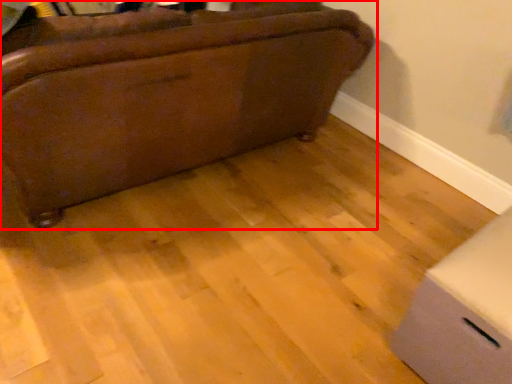
Question: Where is furniture (annotated by the red box) located in relation to cardboard box in the image?

Choices:
 (A) left
 (B) right

Answer: (A)